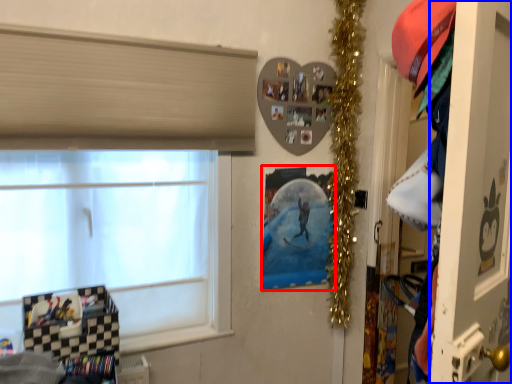
Question: Which of the following is the farthest to the observer, picture frame (highlighted by a red box) or screen door (highlighted by a blue box)?

Choices:
 (A) picture frame
 (B) screen door

Answer: (A)